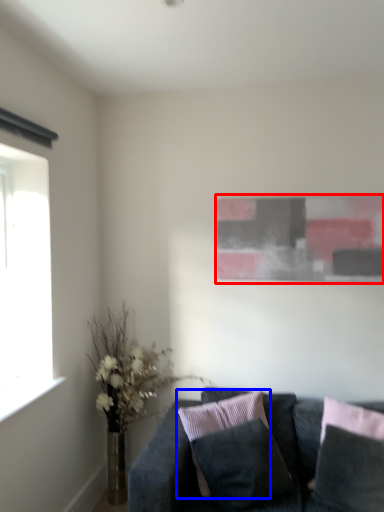
Question: Which point is closer to the camera, picture frame (highlighted by a red box) or pillow (highlighted by a blue box)?

Choices:
 (A) picture frame
 (B) pillow

Answer: (B)